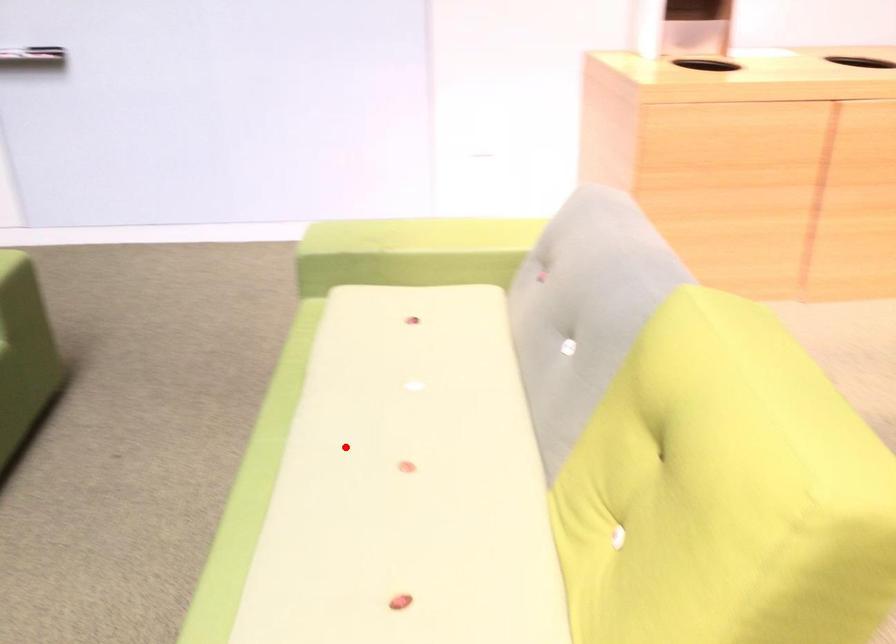
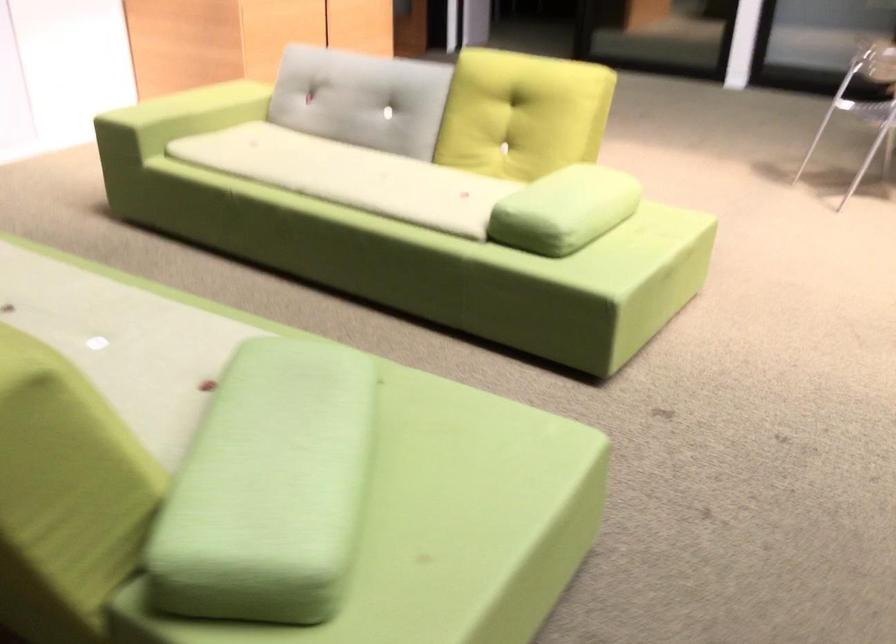
Question: I am providing you with two images of the same scene from different viewpoints. In image1, a red point is highlighted. Considering the same 3D point in image2, which of the following is correct?

Choices:
 (A) It is closer
 (B) It is farther

Answer: (B)